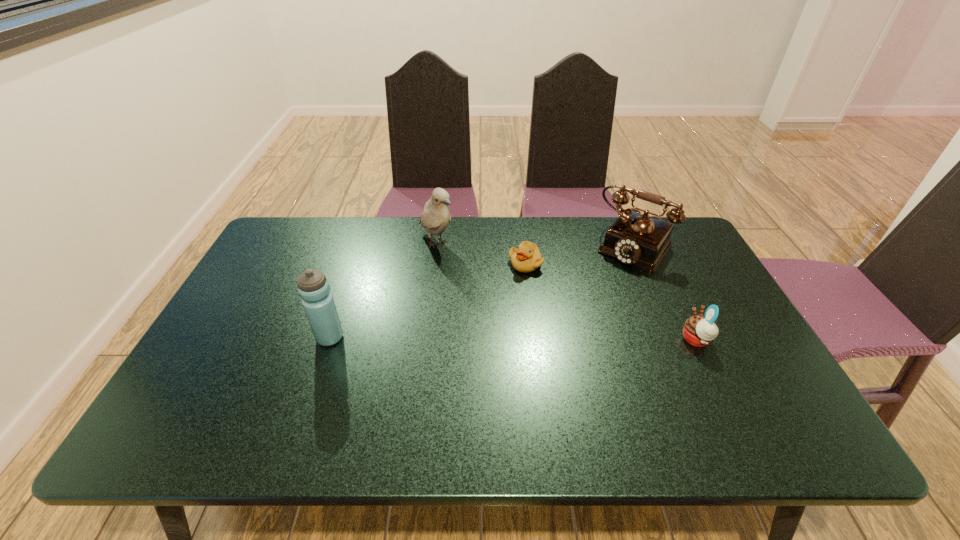
This screenshot has height=540, width=960. I want to click on duckling that is at the far edge, so click(526, 258).

Where is `telephone that is at the far edge`? This screenshot has height=540, width=960. telephone that is at the far edge is located at coordinates (637, 239).

Where is `muffin that is at the right edge`? muffin that is at the right edge is located at coordinates (699, 331).

What are the coordinates of `telephone located at the right edge` in the screenshot? It's located at (637, 239).

You are a GUI agent. You are given a task and a screenshot of the screen. Output one action in this format:
    pyautogui.click(x=<x>, y=<y>)
    Task: Click on the object present at the far right corner
    This screenshot has height=540, width=960.
    Given the screenshot: What is the action you would take?
    pyautogui.click(x=637, y=239)

Image resolution: width=960 pixels, height=540 pixels. Find the location of `vacant region at the far edge of the desktop`. vacant region at the far edge of the desktop is located at coordinates (587, 259).

Where is `blank space at the near edge of the desktop`? The image size is (960, 540). blank space at the near edge of the desktop is located at coordinates (450, 401).

At what (x,y) coordinates should I click in order to perform the action: click on free space at the left edge of the desktop. Please return your answer as a coordinate pair (x, y). This screenshot has height=540, width=960. Looking at the image, I should click on click(x=245, y=307).

Where is `vacant space at the right edge of the desktop`? vacant space at the right edge of the desktop is located at coordinates (695, 273).

Identify the location of free region at the far left corner. Image resolution: width=960 pixels, height=540 pixels. (315, 218).